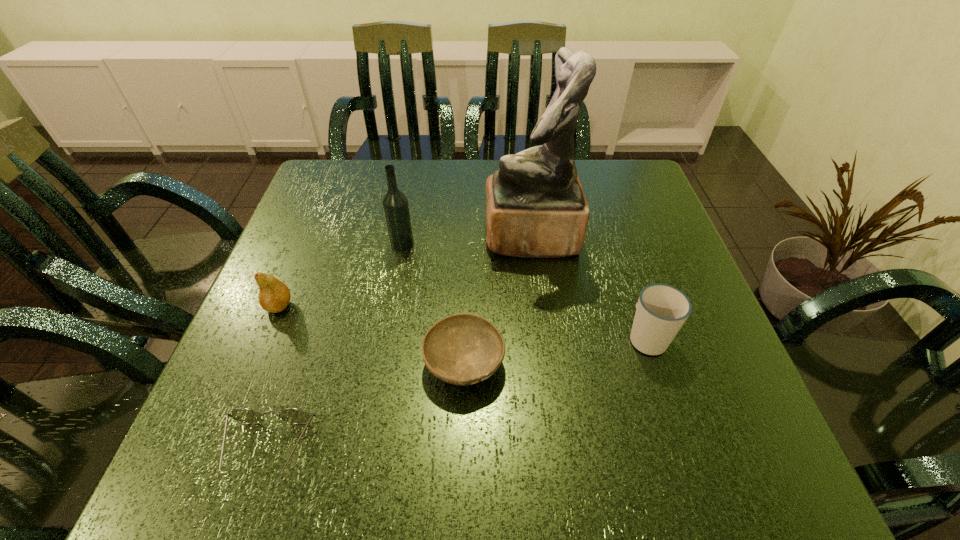
Where is `sculpture`? sculpture is located at coordinates (535, 205).

Locate an element on the screen. the fourth object from right to left is located at coordinates (395, 205).

I want to click on the second tallest object, so click(x=395, y=205).

Image resolution: width=960 pixels, height=540 pixels. I want to click on the rightmost object, so click(661, 310).

Identify the location of pear. (274, 296).

This screenshot has width=960, height=540. I want to click on bowl, so click(462, 349).

This screenshot has height=540, width=960. In order to click on spectacles in this screenshot , I will do `click(245, 415)`.

Find the location of a particular element. Image resolution: width=960 pixels, height=540 pixels. vacant space located in a relaxed pose on the sculpture is located at coordinates (343, 236).

Find the location of a particular element. The image size is (960, 540). vacant space located 0.160m in a relaxed pose on the sculpture is located at coordinates (419, 236).

The width and height of the screenshot is (960, 540). Find the location of `vacant space located in a relaxed pose on the sculpture`. vacant space located in a relaxed pose on the sculpture is located at coordinates (338, 236).